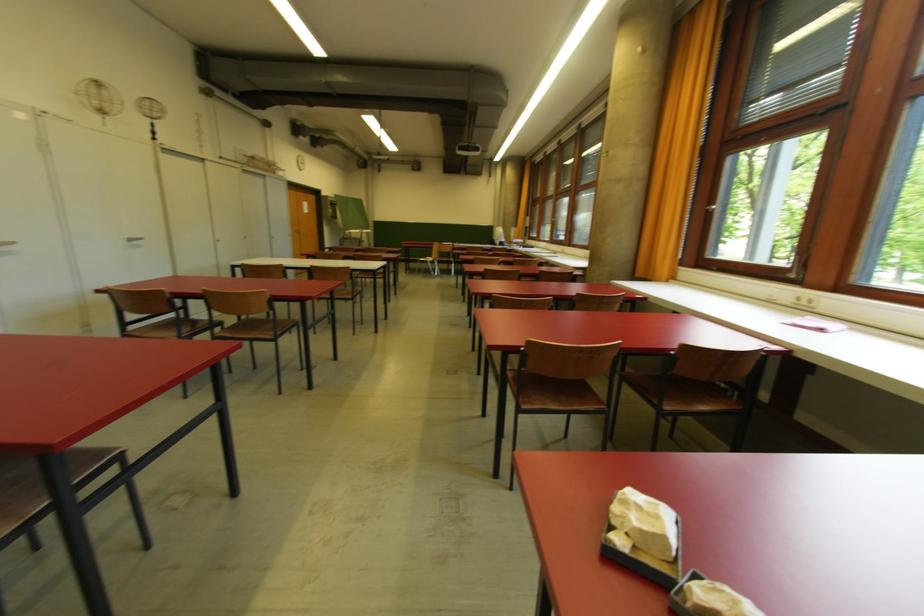
Identify the location of door handle. pos(295,231).